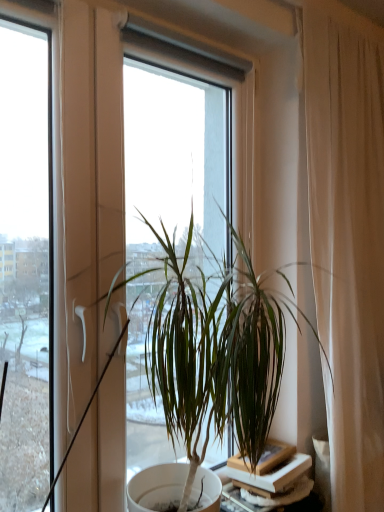
Where is `white matte table at lower right`? white matte table at lower right is located at coordinates (270, 500).

The width and height of the screenshot is (384, 512). What do you see at coordinates (270, 500) in the screenshot?
I see `white matte table at lower right` at bounding box center [270, 500].

What do you see at coordinates (215, 351) in the screenshot? I see `green leafy plant at center` at bounding box center [215, 351].

Locate an element on the screen. This screenshot has width=384, height=512. green leafy plant at center is located at coordinates (215, 351).

You are a GUI agent. You are given a task and a screenshot of the screen. Output one action in this format:
    pyautogui.click(x=<x>, y=<y>)
    Task: Click on the white matte table at lower right
    
    Given the screenshot: What is the action you would take?
    pyautogui.click(x=270, y=500)

Can you confirm if white matte table at lower right is positioned to the right of green leafy plant at center?

Yes.

Who is more distant, white matte table at lower right or green leafy plant at center?

white matte table at lower right is behind.

Considering the points (258, 507) and (241, 423), which point is in front, point (258, 507) or point (241, 423)?

The point (241, 423) is more forward.

From the image's perspective, is white matte table at lower right located above or below green leafy plant at center?

white matte table at lower right is situated lower than green leafy plant at center in the image.

From the picture: From a real-world perspective, which object rests below the other?

From a 3D spatial view, white matte table at lower right is below.

Between white matte table at lower right and green leafy plant at center, which one has larger width?

green leafy plant at center is wider.

Consider the image. Who is taller, white matte table at lower right or green leafy plant at center?

green leafy plant at center is taller.

Does white matte table at lower right have a smaller size compared to green leafy plant at center?

Correct, white matte table at lower right occupies less space than green leafy plant at center.

Could green leafy plant at center be considered to be inside white matte table at lower right?

Actually, green leafy plant at center is outside white matte table at lower right.

Is white matte table at lower right far away from green leafy plant at center?

No, white matte table at lower right is not far away from green leafy plant at center.

Is white matte table at lower right aimed at green leafy plant at center?

No.

Can you tell me how much white matte table at lower right and green leafy plant at center differ in facing direction?

white matte table at lower right and green leafy plant at center are facing 0.00114 degrees away from each other.

Looking at this image, measure the distance from white matte table at lower right to green leafy plant at center.

17.69 inches.

Identify the location of table lying on the right of green leafy plant at center. Image resolution: width=384 pixels, height=512 pixels. (270, 500).

Is green leafy plant at center to the left of white matte table at lower right from the viewer's perspective?

Yes, green leafy plant at center is to the left of white matte table at lower right.

Considering the positions of objects green leafy plant at center and white matte table at lower right in the image provided, who is behind, green leafy plant at center or white matte table at lower right?

white matte table at lower right is more distant.

Does point (244, 361) come behind point (292, 511)?

No, it is in front of (292, 511).

From the image's perspective, is green leafy plant at center over white matte table at lower right?

Yes, from the image's perspective, green leafy plant at center is over white matte table at lower right.

From a real-world perspective, is green leafy plant at center above or below white matte table at lower right?

From a real-world perspective, green leafy plant at center is physically above white matte table at lower right.

Is green leafy plant at center thinner than white matte table at lower right?

No.

Which of these two, green leafy plant at center or white matte table at lower right, stands shorter?

white matte table at lower right is shorter.

Who is smaller, green leafy plant at center or white matte table at lower right?

With smaller size is white matte table at lower right.

Is white matte table at lower right surrounded by green leafy plant at center?

No, green leafy plant at center does not contain white matte table at lower right.

Is green leafy plant at center next to white matte table at lower right?

No, green leafy plant at center is not touching white matte table at lower right.

Does green leafy plant at center turn towards white matte table at lower right?

No.

Can you tell me how much green leafy plant at center and white matte table at lower right differ in facing direction?

0.00114 degrees.

Identify the location of houseplant above the white matte table at lower right (from a real-world perspective). This screenshot has height=512, width=384. (215, 351).

Locate an element on the screen. This screenshot has height=512, width=384. houseplant in front of the white matte table at lower right is located at coordinates (215, 351).

I want to click on houseplant lying on the left of white matte table at lower right, so click(215, 351).